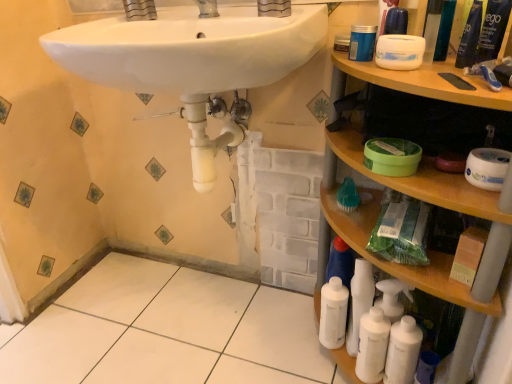
Where is `vacant area that is in front of blue plastic mouthwash at upper right, which is the third mouthwash in right-to-left order`? Image resolution: width=512 pixels, height=384 pixels. vacant area that is in front of blue plastic mouthwash at upper right, which is the third mouthwash in right-to-left order is located at coordinates (446, 75).